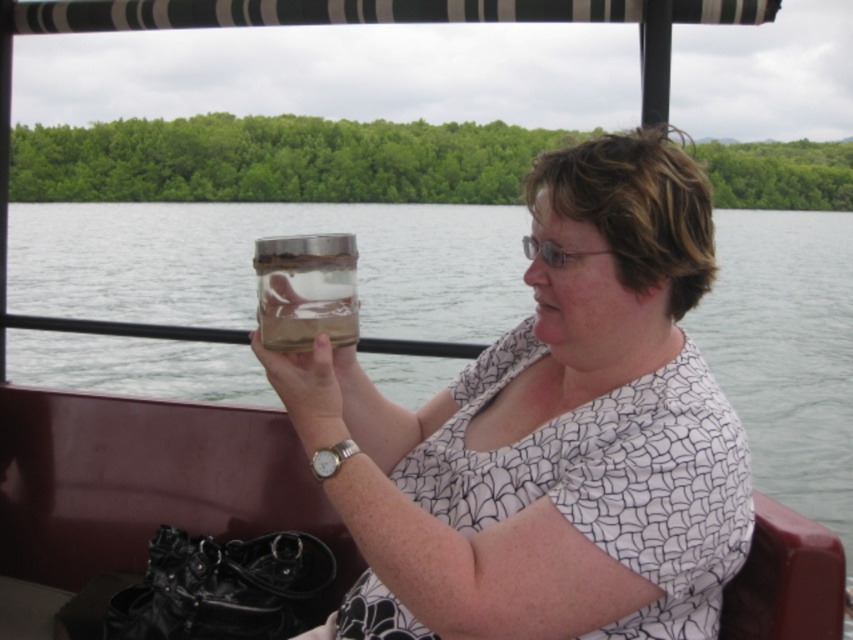
You are a scientist observing the scene. You need to choose the larger jar between the clear glass jar at upper center and the transparent glass jar at center to collect water samples. Which one should you choose?

The clear glass jar at upper center is bigger than the transparent glass jar at center, so you should choose the clear glass jar at upper center to collect water samples.

You are standing on the boat and want to hand the clear glass jar at upper center to someone on the dock 5 feet away from you. Can you reach them without moving?

The clear glass jar at upper center is 3.46 feet away from the viewer. Since the dock is 5 feet away, which is farther than the distance to the jar, you cannot reach them without moving.